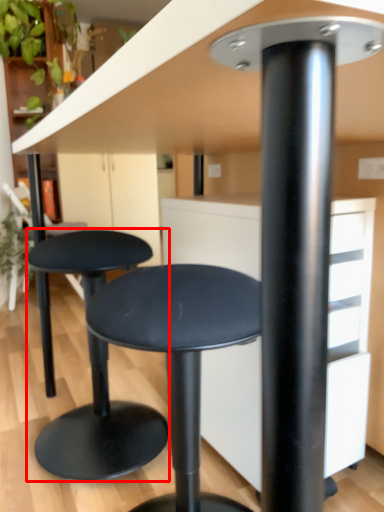
Question: From the image's perspective, where is stool (annotated by the red box) located in relation to stool in the image?

Choices:
 (A) above
 (B) below

Answer: (A)